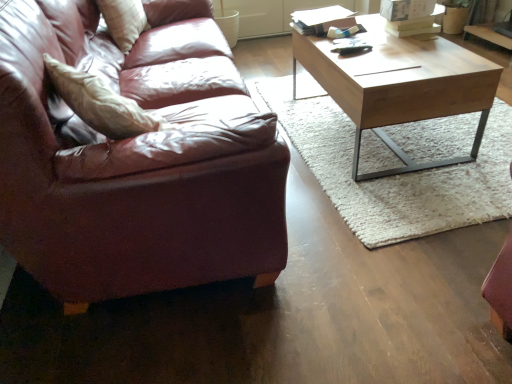
The width and height of the screenshot is (512, 384). Describe the element at coordinates (401, 86) in the screenshot. I see `light brown wood coffee table at center` at that location.

Where is `plush white pillow at upper left`? The width and height of the screenshot is (512, 384). plush white pillow at upper left is located at coordinates (124, 21).

In the image, is light brown wood coffee table at center positioned in front of or behind leather couch at left?

Clearly, light brown wood coffee table at center is behind leather couch at left.

Would you say light brown wood coffee table at center is a long distance from leather couch at left?

No, light brown wood coffee table at center is not far from leather couch at left.

How much distance is there between light brown wood coffee table at center and leather couch at left?

They are 31.39 inches apart.

Does plush white pillow at upper left have a greater height compared to leather couch at left?

Incorrect, the height of plush white pillow at upper left is not larger of that of leather couch at left.

From a real-world perspective, which is physically below, plush white pillow at upper left or leather couch at left?

leather couch at left, from a real-world perspective.

In the scene shown: Which of these two, plush white pillow at upper left or leather couch at left, is smaller?

With smaller size is plush white pillow at upper left.

Can you confirm if light brown wood coffee table at center is smaller than plush white pillow at upper left?

No.

Is light brown wood coffee table at center not inside plush white pillow at upper left?

light brown wood coffee table at center is positioned outside plush white pillow at upper left.

In the scene shown: What's the angular difference between light brown wood coffee table at center and plush white pillow at upper left's facing directions?

14.8 degrees.

Where is `pillow that appears on the left of light brown wood coffee table at center`? Image resolution: width=512 pixels, height=384 pixels. pillow that appears on the left of light brown wood coffee table at center is located at coordinates (124, 21).

Measure the distance between leather couch at left and light brown wood coffee table at center.

They are 31.39 inches apart.

Which of these two, leather couch at left or light brown wood coffee table at center, is bigger?

Bigger between the two is light brown wood coffee table at center.

Is leather couch at left not inside light brown wood coffee table at center?

Indeed, leather couch at left is completely outside light brown wood coffee table at center.

Are leather couch at left and light brown wood coffee table at center far apart?

No, leather couch at left is not far from light brown wood coffee table at center.

Can we say plush white pillow at upper left lies outside light brown wood coffee table at center?

Yes, plush white pillow at upper left is located beyond the bounds of light brown wood coffee table at center.

You are a GUI agent. You are given a task and a screenshot of the screen. Output one action in this format:
    pyautogui.click(x=<x>, y=<y>)
    Task: Click on the coffee table that appears below the plush white pillow at upper left (from the image's perspective)
    
    Given the screenshot: What is the action you would take?
    pyautogui.click(x=401, y=86)

Is point (128, 38) positioned before point (319, 70)?

No, (128, 38) is behind (319, 70).

In terms of width, does plush white pillow at upper left look wider or thinner when compared to light brown wood coffee table at center?

Clearly, plush white pillow at upper left has less width compared to light brown wood coffee table at center.

Between leather couch at left and plush white pillow at upper left, which one has more height?

Standing taller between the two is leather couch at left.

From a real-world perspective, which is physically above, leather couch at left or plush white pillow at upper left?

plush white pillow at upper left is physically above.

From the image's perspective, is leather couch at left under plush white pillow at upper left?

Correct, leather couch at left appears lower than plush white pillow at upper left in the image.

Image resolution: width=512 pixels, height=384 pixels. Identify the location of studio couch in front of the plush white pillow at upper left. (136, 159).

This screenshot has height=384, width=512. Identify the location of studio couch on the left of light brown wood coffee table at center. (136, 159).

Locate an element on the screen. studio couch that is in front of the plush white pillow at upper left is located at coordinates (136, 159).

When comparing their distances from plush white pillow at upper left, does leather couch at left or light brown wood coffee table at center seem closer?

The object closer to plush white pillow at upper left is leather couch at left.

Considering their positions, is plush white pillow at upper left positioned closer to leather couch at left than light brown wood coffee table at center?

Based on the image, plush white pillow at upper left appears to be nearer to leather couch at left.

From the image, which object appears to be nearer to leather couch at left, light brown wood coffee table at center or plush white pillow at upper left?

plush white pillow at upper left is positioned closer to the anchor leather couch at left.

Considering their positions, is plush white pillow at upper left positioned closer to light brown wood coffee table at center than leather couch at left?

Among the two, leather couch at left is located nearer to light brown wood coffee table at center.

Based on their spatial positions, is light brown wood coffee table at center or leather couch at left further from plush white pillow at upper left?

Among the two, light brown wood coffee table at center is located further to plush white pillow at upper left.

From the image, which object appears to be nearer to light brown wood coffee table at center, leather couch at left or plush white pillow at upper left?

Among the two, leather couch at left is located nearer to light brown wood coffee table at center.

This screenshot has width=512, height=384. What are the coordinates of `studio couch between plush white pillow at upper left and light brown wood coffee table at center in the horizontal direction` in the screenshot? It's located at (136, 159).